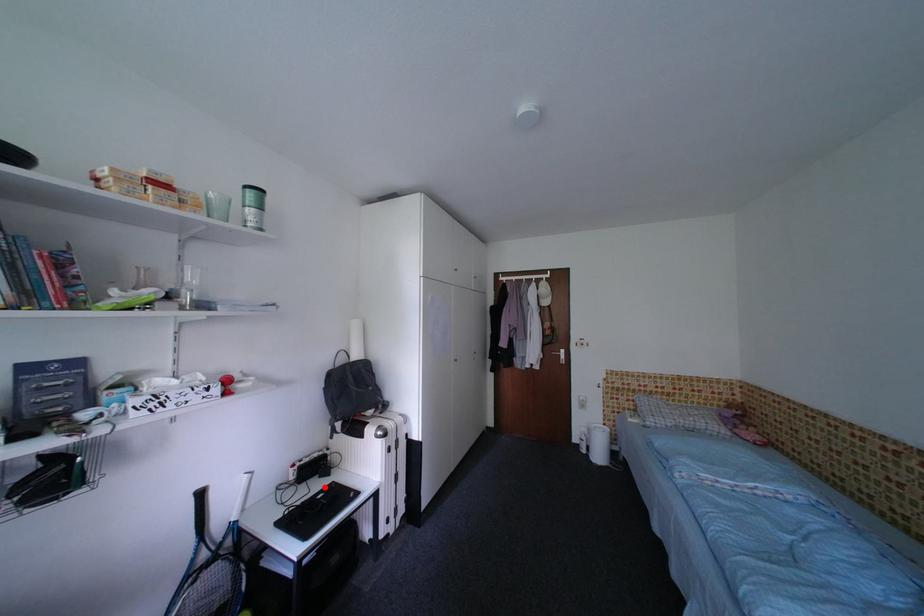
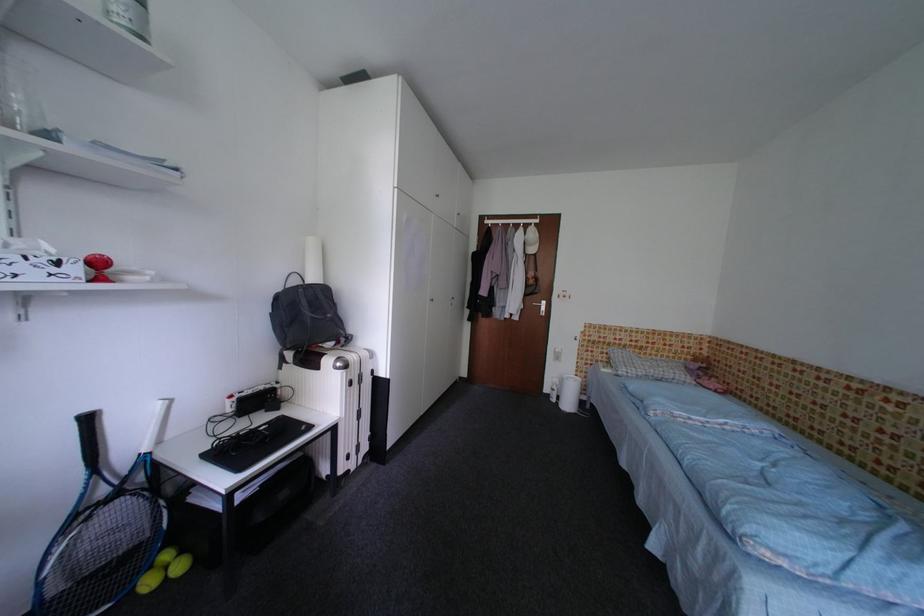
Question: I am providing you with two images of the same scene from different viewpoints. A red point is marked on the first image. Can you still see the location of the red point in image 2?

Choices:
 (A) Yes
 (B) No

Answer: (A)